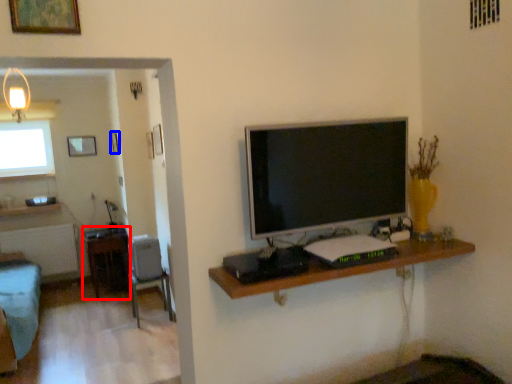
Question: Which object is further to the camera taking this photo, table (highlighted by a red box) or picture frame (highlighted by a blue box)?

Choices:
 (A) table
 (B) picture frame

Answer: (B)